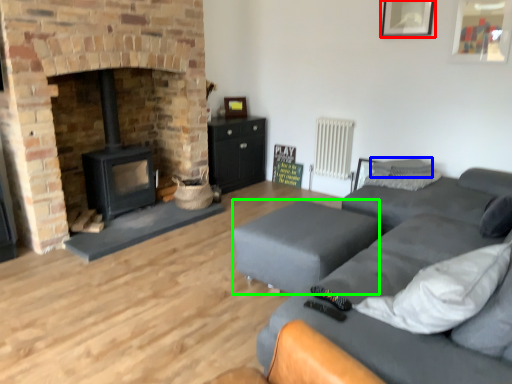
Question: Estimate the real-world distances between objects in this image. Which object is closer to picture frame (highlighted by a red box), pillow (highlighted by a blue box) or flat (highlighted by a green box)?

Choices:
 (A) pillow
 (B) flat

Answer: (A)